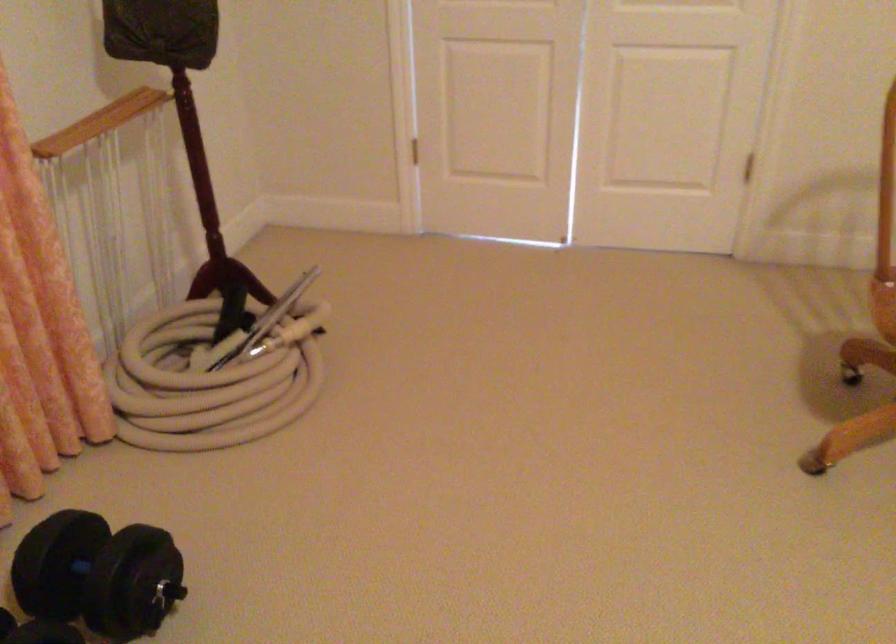
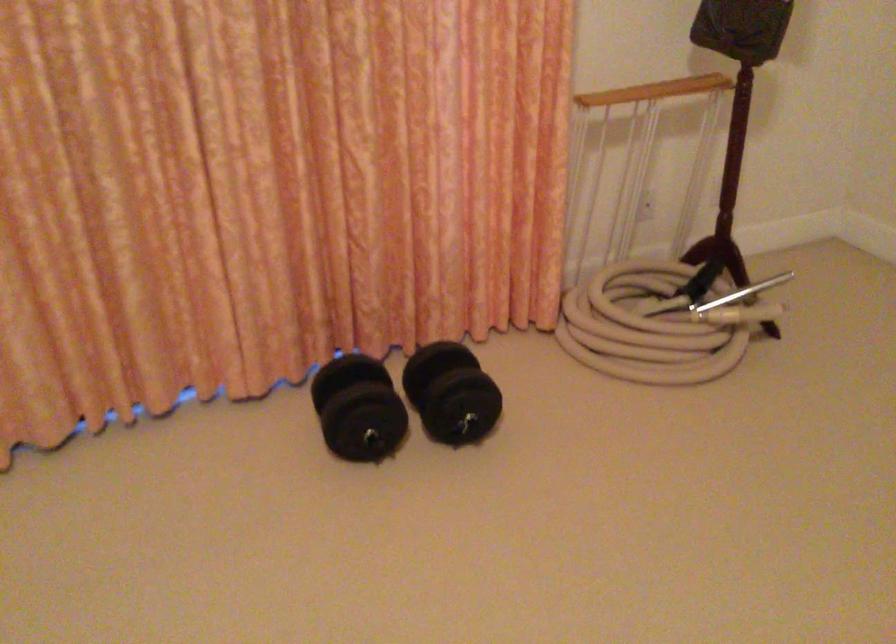
Locate, in the second image, the point that corresponds to (179,169) in the first image.

(719, 137)